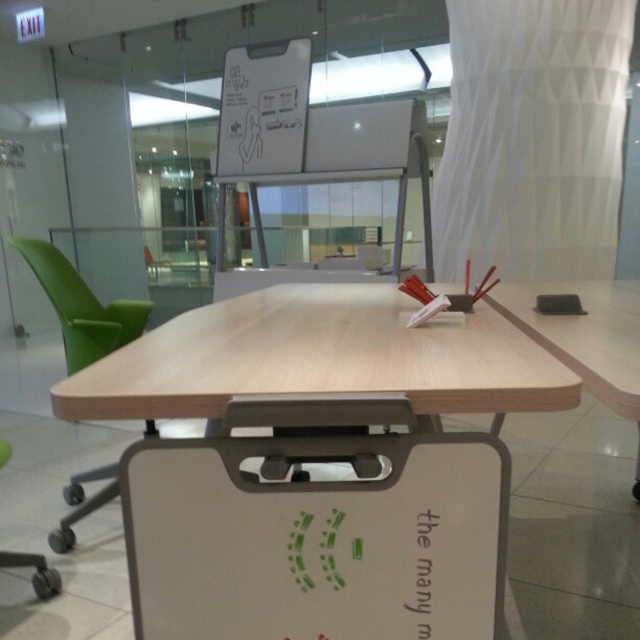
You are standing in the middle of the room and want to place a new object at the point with coordinates (x=317, y=358). According to the image, what is located at that point?

The point (x=317, y=358) corresponds to the light wood table at center, so placing the new object there would require moving the existing table.

You are standing in the office and need to reach a document on the table. The green plastic chair at left is in your way. Can you step around it without moving the chair?

The green plastic chair at left is 1.87 meters from viewer, so yes, you can step around it as it is far enough away to maneuver around without needing to move the chair.